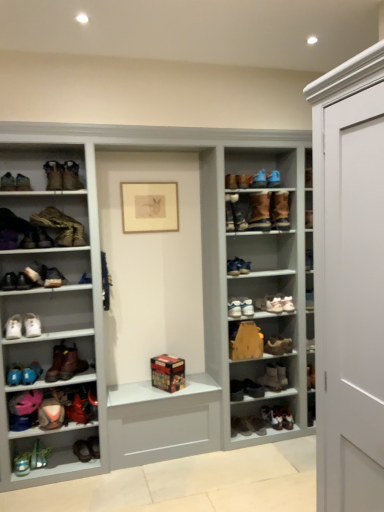
Find the location of `space that is in front of leather boot at lower center, placed as the fifth footwear when sorted from bottom to top`. space that is in front of leather boot at lower center, placed as the fifth footwear when sorted from bottom to top is located at coordinates (295, 438).